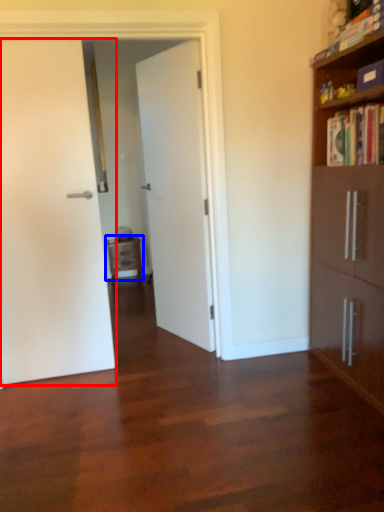
Question: Among these objects, which one is farthest to the camera, door (highlighted by a red box) or nightstand (highlighted by a blue box)?

Choices:
 (A) door
 (B) nightstand

Answer: (B)